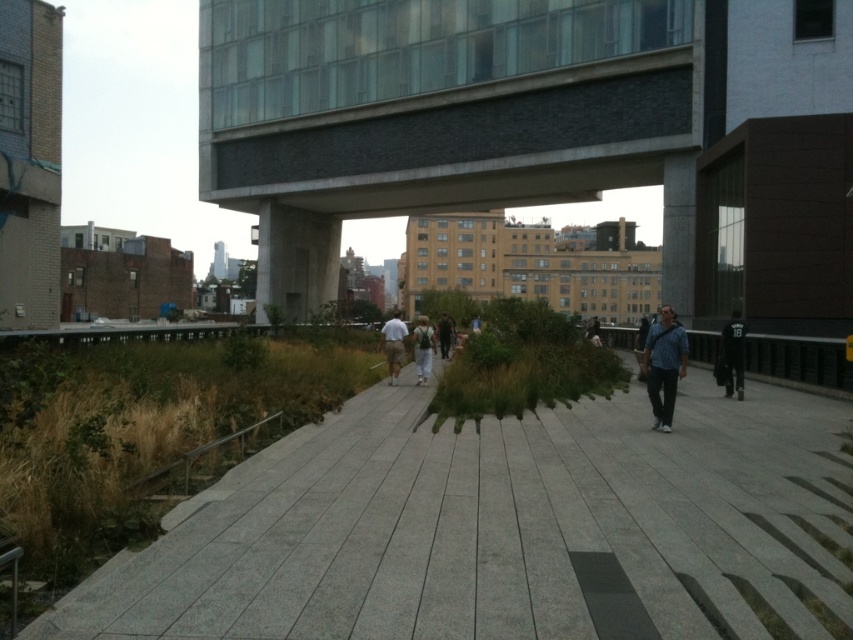
Question: Does light blue shirt at center appear on the right side of light gray fabric jacket at center?

Choices:
 (A) no
 (B) yes

Answer: (A)

Question: Estimate the real-world distances between objects in this image. Which object is closer to the blue denim jacket at right?

Choices:
 (A) dark brown leather jacket at center
 (B) gray concrete pavement at center
 (C) dark blue jersey at center

Answer: (B)

Question: Can you confirm if dark blue jersey at center is positioned to the left of light gray fabric jacket at center?

Choices:
 (A) no
 (B) yes

Answer: (A)

Question: Is glass concrete bridge at upper center closer to camera compared to light blue shirt at center?

Choices:
 (A) yes
 (B) no

Answer: (B)

Question: Which point is farther from the camera taking this photo?

Choices:
 (A) (740, 342)
 (B) (613, 440)

Answer: (A)

Question: Which point is closer to the camera?

Choices:
 (A) tap(444, 353)
 (B) tap(717, 499)

Answer: (B)